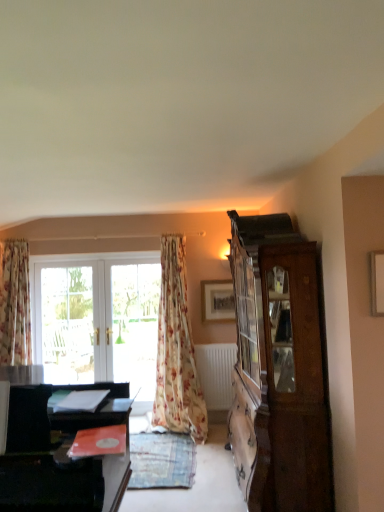
Question: Is floral fabric curtain at left, which is the 2th curtain from right to left, closer to the viewer compared to wooden cabinet at right?

Choices:
 (A) yes
 (B) no

Answer: (B)

Question: Is floral fabric curtain at left, which is the 2th curtain from right to left, shorter than wooden cabinet at right?

Choices:
 (A) yes
 (B) no

Answer: (A)

Question: From a real-world perspective, is floral fabric curtain at left, the first curtain positioned from the left, positioned over wooden cabinet at right based on gravity?

Choices:
 (A) no
 (B) yes

Answer: (B)

Question: From the image's perspective, would you say floral fabric curtain at left, which is the 2th curtain from right to left, is positioned over wooden cabinet at right?

Choices:
 (A) yes
 (B) no

Answer: (A)

Question: Considering the relative positions of floral fabric curtain at left, which is the 2th curtain from right to left, and wooden cabinet at right in the image provided, is floral fabric curtain at left, which is the 2th curtain from right to left, to the left of wooden cabinet at right from the viewer's perspective?

Choices:
 (A) no
 (B) yes

Answer: (B)

Question: Choose the correct answer: Is white glass door at center, which is the 2th window from left to right, inside wooden picture frame at upper center or outside it?

Choices:
 (A) outside
 (B) inside

Answer: (A)

Question: Is white glass door at center, which is the 2th window from left to right, in front of or behind wooden picture frame at upper center in the image?

Choices:
 (A) behind
 (B) front

Answer: (A)

Question: Considering the positions of white glass door at center, which is counted as the 1th window, starting from the right, and wooden picture frame at upper center in the image, is white glass door at center, which is counted as the 1th window, starting from the right, wider or thinner than wooden picture frame at upper center?

Choices:
 (A) wide
 (B) thin

Answer: (A)

Question: Is white glass door at center, which is counted as the 1th window, starting from the right, to the left or to the right of wooden picture frame at upper center in the image?

Choices:
 (A) right
 (B) left

Answer: (B)

Question: Is wooden cabinet at right wider or thinner than white glossy screen door at center?

Choices:
 (A) thin
 (B) wide

Answer: (B)

Question: Is wooden cabinet at right taller or shorter than white glossy screen door at center?

Choices:
 (A) short
 (B) tall

Answer: (B)

Question: Considering the positions of point (314, 413) and point (139, 364), is point (314, 413) closer or farther from the camera than point (139, 364)?

Choices:
 (A) farther
 (B) closer

Answer: (B)

Question: Is wooden cabinet at right in front of or behind white glossy screen door at center in the image?

Choices:
 (A) front
 (B) behind

Answer: (A)

Question: Based on their sizes in the image, would you say wooden picture frame at upper center is bigger or smaller than floral fabric curtain at left, which is the 2th curtain from right to left?

Choices:
 (A) small
 (B) big

Answer: (A)

Question: Visually, is wooden picture frame at upper center positioned to the left or to the right of floral fabric curtain at left, which is the 2th curtain from right to left?

Choices:
 (A) right
 (B) left

Answer: (A)